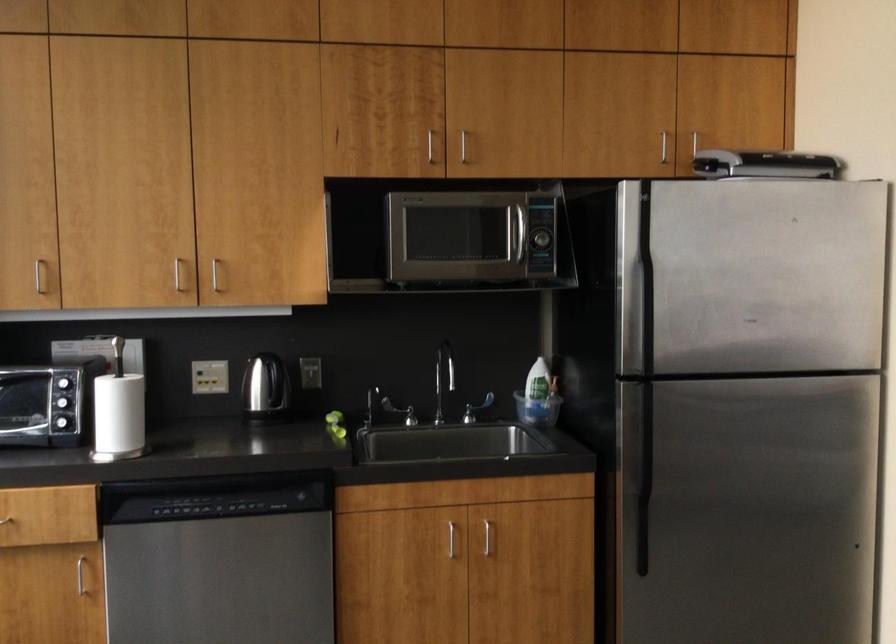
Where is `microwave door handle`? This screenshot has width=896, height=644. microwave door handle is located at coordinates (515, 230).